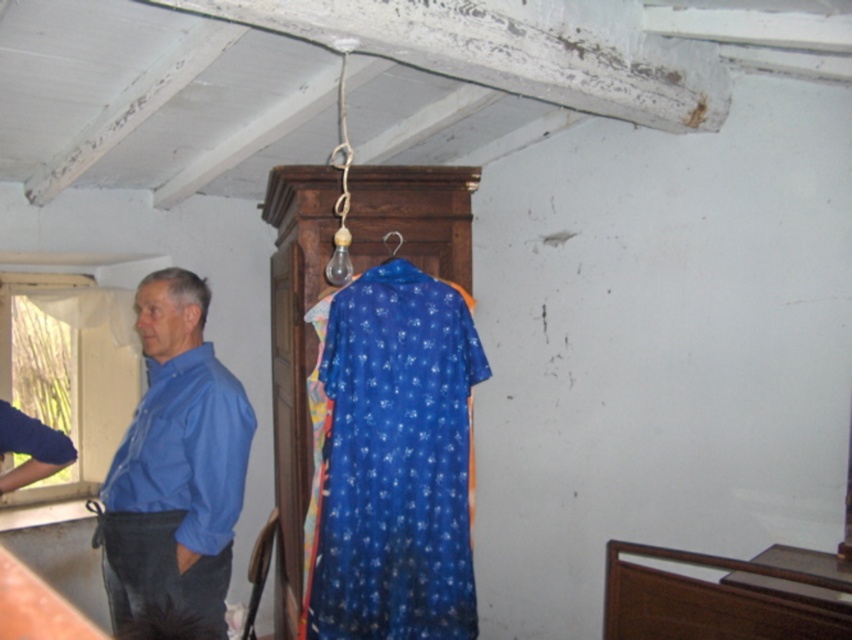
In the scene shown: Can you confirm if blue cotton shirt at center is shorter than metallic hook at center?

No.

Measure the distance between blue cotton shirt at center and camera.

They are 7.95 feet apart.

Find the location of a particular element. This screenshot has height=640, width=852. blue cotton shirt at center is located at coordinates (393, 461).

Does blue cotton shirt at center appear over matte blue shirt at left?

No.

Where is `blue cotton shirt at center`? This screenshot has width=852, height=640. blue cotton shirt at center is located at coordinates click(x=393, y=461).

You are a GUI agent. You are given a task and a screenshot of the screen. Output one action in this format:
    pyautogui.click(x=<x>, y=<y>)
    Task: Click on the blue cotton shirt at center
    
    Given the screenshot: What is the action you would take?
    pyautogui.click(x=393, y=461)

You are a GUI agent. You are given a task and a screenshot of the screen. Output one action in this format:
    pyautogui.click(x=<x>, y=<y>)
    Task: Click on the blue cotton shirt at center
    
    Given the screenshot: What is the action you would take?
    pyautogui.click(x=393, y=461)

In the scene shown: Who is shorter, matte blue shirt at left or metallic hook at center?

With less height is metallic hook at center.

Between point (101, 522) and point (387, 244), which one is positioned in front?

Point (101, 522)

This screenshot has width=852, height=640. In order to click on matte blue shirt at left in this screenshot , I will do `click(176, 465)`.